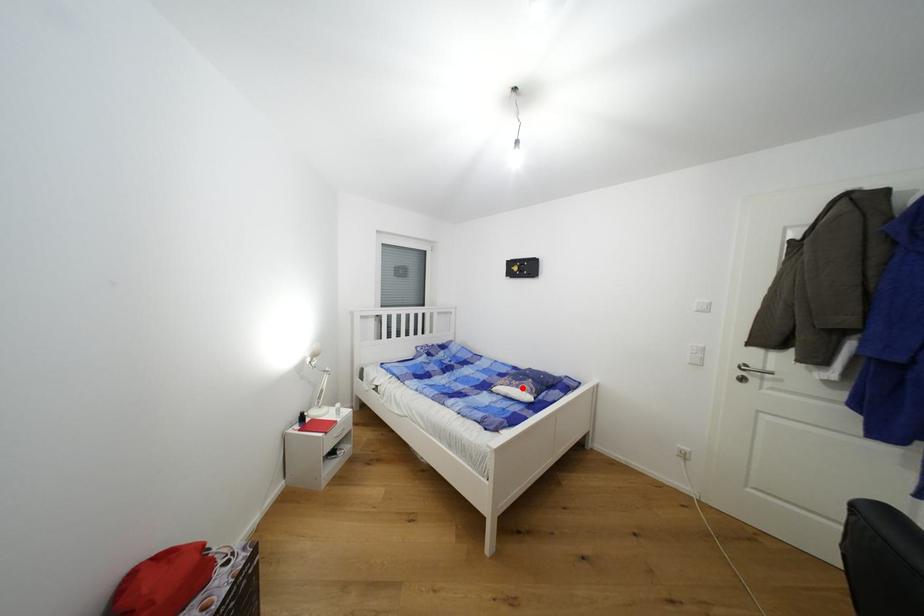
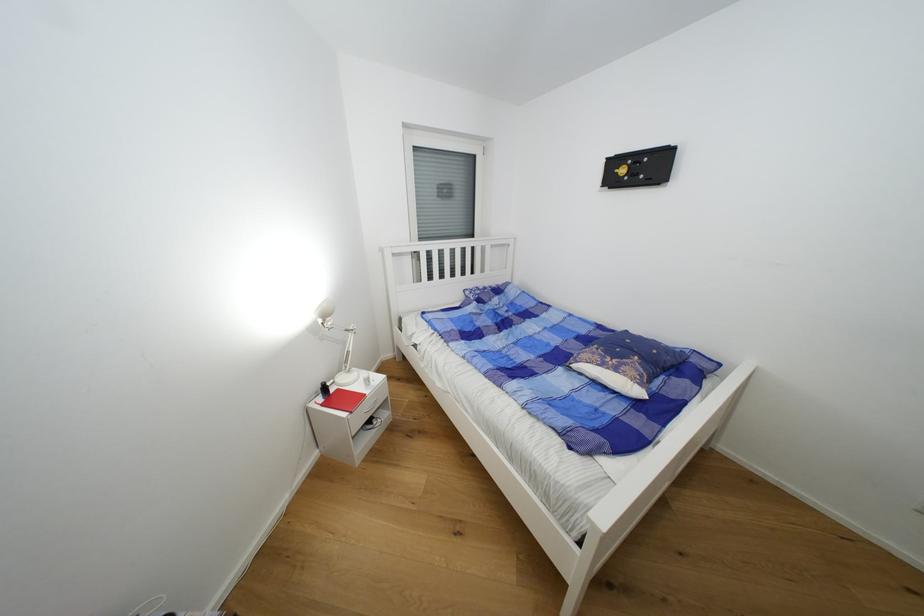
In the second image, find the point that corresponds to the highlighted location in the first image.

(622, 371)